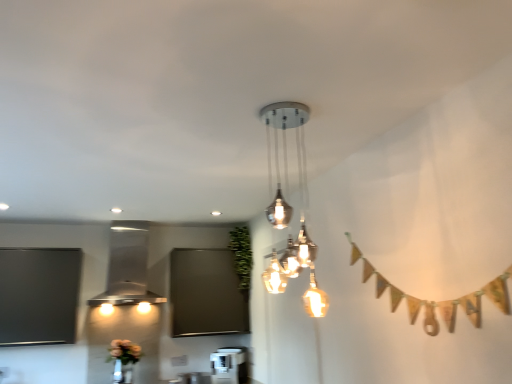
Where is `green leafy plant at center`? This screenshot has width=512, height=384. green leafy plant at center is located at coordinates (x=241, y=254).

The width and height of the screenshot is (512, 384). Find the location of `matte floral arrangement at lower left`. matte floral arrangement at lower left is located at coordinates 124,351.

How distant is stainless steel range hood at left, which is counted as the second lamp, starting from the right, from green leafy plant at center?

36.54 inches.

Is stainless steel range hood at left, marked as the 2th lamp in a front-to-back arrangement, thinner than green leafy plant at center?

No, stainless steel range hood at left, marked as the 2th lamp in a front-to-back arrangement, is not thinner than green leafy plant at center.

Looking at this image, can we say stainless steel range hood at left, marked as the 2th lamp in a front-to-back arrangement, lies outside green leafy plant at center?

Yes, stainless steel range hood at left, marked as the 2th lamp in a front-to-back arrangement, is not within green leafy plant at center.

From a real-world perspective, between stainless steel range hood at left, marked as the 2th lamp in a front-to-back arrangement, and green leafy plant at center, who is vertically higher?

In real-world perspective, green leafy plant at center is above.

Is point (117, 266) positioned behind point (301, 180)?

Yes, it is behind point (301, 180).

Is the depth of stainless steel range hood at left, marked as the 1th lamp in a left-to-right arrangement, less than that of satin silver pendant light at center, which is the second lamp in back-to-front order?

That is False.

Based on their positions, is stainless steel range hood at left, which is counted as the second lamp, starting from the right, located to the left or right of satin silver pendant light at center, the 1th lamp viewed from the right?

In the image, stainless steel range hood at left, which is counted as the second lamp, starting from the right, appears on the left side of satin silver pendant light at center, the 1th lamp viewed from the right.

Considering the relative sizes of satin silver pendant light at center, marked as the 1th lamp in a front-to-back arrangement, and green leafy plant at center in the image provided, is satin silver pendant light at center, marked as the 1th lamp in a front-to-back arrangement, thinner than green leafy plant at center?

Correct, the width of satin silver pendant light at center, marked as the 1th lamp in a front-to-back arrangement, is less than that of green leafy plant at center.

Does point (280, 183) appear closer or farther from the camera than point (231, 239)?

Point (280, 183).

From a real-world perspective, is satin silver pendant light at center, which appears as the 2th lamp when viewed from the left, beneath green leafy plant at center?

Yes.

From a real-world perspective, who is located higher, green leafy plant at center or satin silver pendant light at center, the 1th lamp viewed from the right?

green leafy plant at center is physically above.

Does green leafy plant at center lie behind satin silver pendant light at center, which is the second lamp in back-to-front order?

Yes, it is behind satin silver pendant light at center, which is the second lamp in back-to-front order.

Does point (244, 251) appear closer or farther from the camera than point (273, 138)?

Point (244, 251) is farther from the camera than point (273, 138).

Does matte floral arrangement at lower left have a greater width compared to satin silver pendant light at center, the 1th lamp viewed from the right?

In fact, matte floral arrangement at lower left might be narrower than satin silver pendant light at center, the 1th lamp viewed from the right.

Does matte floral arrangement at lower left have a lesser height compared to satin silver pendant light at center, which is the second lamp in back-to-front order?

Yes.

Is matte floral arrangement at lower left inside or outside of satin silver pendant light at center, the 1th lamp viewed from the right?

The correct answer is: outside.

Identify the location of the 2nd lamp positioned above the matte floral arrangement at lower left (from a real-world perspective). click(127, 267).

Is stainless steel range hood at left, marked as the 1th lamp in a left-to-right arrangement, at the back of matte floral arrangement at lower left?

No, matte floral arrangement at lower left is not facing the opposite direction of stainless steel range hood at left, marked as the 1th lamp in a left-to-right arrangement.

Consider the image. Which object is positioned more to the left, matte floral arrangement at lower left or stainless steel range hood at left, marked as the 2th lamp in a front-to-back arrangement?

stainless steel range hood at left, marked as the 2th lamp in a front-to-back arrangement, is more to the left.

In the scene shown: In terms of width, does matte floral arrangement at lower left look wider or thinner when compared to stainless steel range hood at left, marked as the 1th lamp in a left-to-right arrangement?

In the image, matte floral arrangement at lower left appears to be more narrow than stainless steel range hood at left, marked as the 1th lamp in a left-to-right arrangement.

Looking at the image, does matte floral arrangement at lower left seem bigger or smaller compared to green leafy plant at center?

Clearly, matte floral arrangement at lower left is smaller in size than green leafy plant at center.

From the image's perspective, does matte floral arrangement at lower left appear higher than green leafy plant at center?

No.

Considering their positions, is matte floral arrangement at lower left located in front of or behind green leafy plant at center?

matte floral arrangement at lower left is in front of green leafy plant at center.

You are a GUI agent. You are given a task and a screenshot of the screen. Output one action in this format:
    pyautogui.click(x=<x>, y=<y>)
    Task: Click on the lamp to the left of green leafy plant at center
    
    Given the screenshot: What is the action you would take?
    pyautogui.click(x=127, y=267)

Where is `lamp behind the satin silver pendant light at center, which appears as the 2th lamp when viewed from the left`? Image resolution: width=512 pixels, height=384 pixels. lamp behind the satin silver pendant light at center, which appears as the 2th lamp when viewed from the left is located at coordinates (127, 267).

Looking at this image, based on their spatial positions, is matte floral arrangement at lower left or green leafy plant at center closer to satin silver pendant light at center, marked as the 1th lamp in a front-to-back arrangement?

Among the two, green leafy plant at center is located nearer to satin silver pendant light at center, marked as the 1th lamp in a front-to-back arrangement.

Based on their spatial positions, is satin silver pendant light at center, which appears as the 2th lamp when viewed from the left, or matte floral arrangement at lower left further from green leafy plant at center?

matte floral arrangement at lower left.

Based on their spatial positions, is matte floral arrangement at lower left or satin silver pendant light at center, which is the second lamp in back-to-front order, closer to stainless steel range hood at left, marked as the 2th lamp in a front-to-back arrangement?

matte floral arrangement at lower left lies closer to stainless steel range hood at left, marked as the 2th lamp in a front-to-back arrangement, than the other object.

Which object lies further to the anchor point green leafy plant at center, stainless steel range hood at left, marked as the 2th lamp in a front-to-back arrangement, or satin silver pendant light at center, which is the second lamp in back-to-front order?

satin silver pendant light at center, which is the second lamp in back-to-front order, is positioned further to the anchor green leafy plant at center.

From the image, which object appears to be nearer to satin silver pendant light at center, marked as the 1th lamp in a front-to-back arrangement, stainless steel range hood at left, the first lamp in the back-to-front sequence, or green leafy plant at center?

The object closer to satin silver pendant light at center, marked as the 1th lamp in a front-to-back arrangement, is green leafy plant at center.

Considering their positions, is satin silver pendant light at center, which appears as the 2th lamp when viewed from the left, positioned further to matte floral arrangement at lower left than stainless steel range hood at left, marked as the 2th lamp in a front-to-back arrangement?

satin silver pendant light at center, which appears as the 2th lamp when viewed from the left, lies further to matte floral arrangement at lower left than the other object.

Based on their spatial positions, is stainless steel range hood at left, marked as the 2th lamp in a front-to-back arrangement, or matte floral arrangement at lower left further from green leafy plant at center?

Based on the image, matte floral arrangement at lower left appears to be further to green leafy plant at center.

Estimate the real-world distances between objects in this image. Which object is further from matte floral arrangement at lower left, stainless steel range hood at left, marked as the 2th lamp in a front-to-back arrangement, or green leafy plant at center?

Based on the image, green leafy plant at center appears to be further to matte floral arrangement at lower left.

The image size is (512, 384). I want to click on flower between satin silver pendant light at center, which is the second lamp in back-to-front order, and green leafy plant at center from front to back, so pos(124,351).

The height and width of the screenshot is (384, 512). In order to click on lamp between satin silver pendant light at center, marked as the 1th lamp in a front-to-back arrangement, and matte floral arrangement at lower left from front to back in this screenshot , I will do `click(127, 267)`.

Locate an element on the screen. This screenshot has height=384, width=512. flower between stainless steel range hood at left, marked as the 2th lamp in a front-to-back arrangement, and green leafy plant at center, in the horizontal direction is located at coordinates (124, 351).

I want to click on lamp between satin silver pendant light at center, which is the second lamp in back-to-front order, and green leafy plant at center, along the z-axis, so click(127, 267).